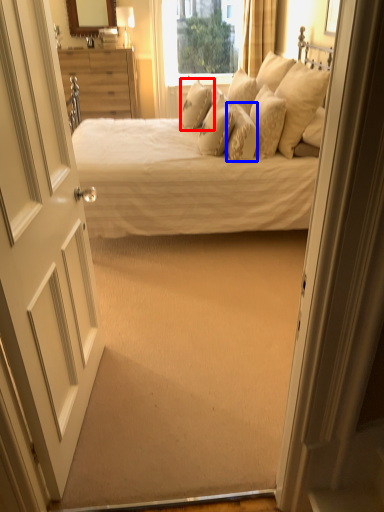
Question: Which object is further to the camera taking this photo, pillow (highlighted by a red box) or pillow (highlighted by a blue box)?

Choices:
 (A) pillow
 (B) pillow

Answer: (A)